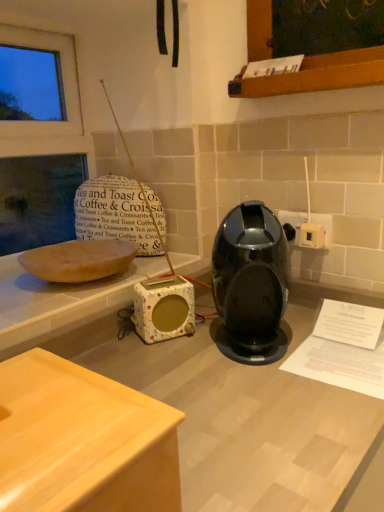
Question: Is white fabric-covered speaker at center in front of or behind white plastic electric outlet at right, the 1th electric outlet when ordered from front to back, in the image?

Choices:
 (A) front
 (B) behind

Answer: (A)

Question: Choose the correct answer: Is white fabric-covered speaker at center inside white plastic electric outlet at right, the 1th electric outlet when ordered from front to back, or outside it?

Choices:
 (A) outside
 (B) inside

Answer: (A)

Question: Estimate the real-world distances between objects in this image. Which object is farther from the white plastic electric outlet at right, the second electric outlet from the front?

Choices:
 (A) glossy plastic coffee machine at center
 (B) white plastic electric outlet at right, the 1th electric outlet when ordered from front to back
 (C) white fabric-covered speaker at center
 (D) wooden at lower left

Answer: (D)

Question: Considering the real-world distances, which object is closest to the white plastic electric outlet at right, which is counted as the first electric outlet, starting from the back?

Choices:
 (A) white fabric-covered speaker at center
 (B) white plastic electric outlet at right, the 1th electric outlet when ordered from front to back
 (C) glossy plastic coffee machine at center
 (D) wooden at lower left

Answer: (B)